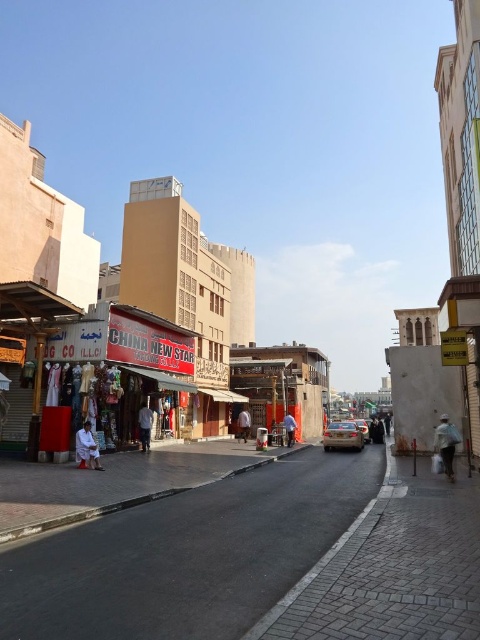
Question: Is white fabric bag at lower right to the right of white fabric person at lower left from the viewer's perspective?

Choices:
 (A) no
 (B) yes

Answer: (B)

Question: Estimate the real-world distances between objects in this image. Which object is farther from the white fabric bag at lower right?

Choices:
 (A) white fabric person at lower left
 (B) white cotton shirt at center
 (C) orange fabric at center
 (D) brown fabric person at center

Answer: (D)

Question: Which of the following is the closest to the observer?

Choices:
 (A) (240, 436)
 (B) (141, 433)
 (C) (446, 444)
 (D) (285, 426)

Answer: (C)

Question: Is white cotton shirt at center to the right of brown fabric person at center from the viewer's perspective?

Choices:
 (A) no
 (B) yes

Answer: (A)

Question: Does brown fabric person at center have a smaller size compared to orange fabric at center?

Choices:
 (A) no
 (B) yes

Answer: (B)

Question: Which point is closer to the camera taking this photo?

Choices:
 (A) (81, 442)
 (B) (292, 428)

Answer: (A)